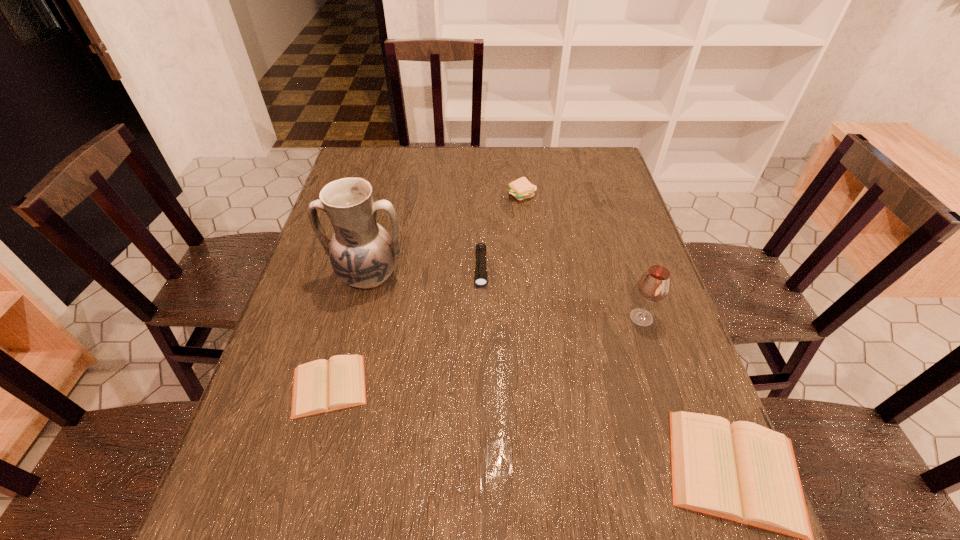
The height and width of the screenshot is (540, 960). Find the location of `free space between the tallest object and the third object from right to left`. free space between the tallest object and the third object from right to left is located at coordinates pyautogui.click(x=445, y=236).

This screenshot has width=960, height=540. What are the coordinates of `object that can be found as the fourth closest to the tallest object` in the screenshot? It's located at (654, 285).

Choose which object is the second nearest neighbor to the fourth object from left to right. Please provide its 2D coordinates. Your answer should be formatted as a tuple, i.e. [(x, y)], where the tuple contains the x and y coordinates of a point satisfying the conditions above.

[(362, 253)]

This screenshot has width=960, height=540. I want to click on vacant area in the image that satisfies the following two spatial constraints: 1. at the lens end of the fourth object from right to left; 2. on the left side of the second tallest object, so click(481, 318).